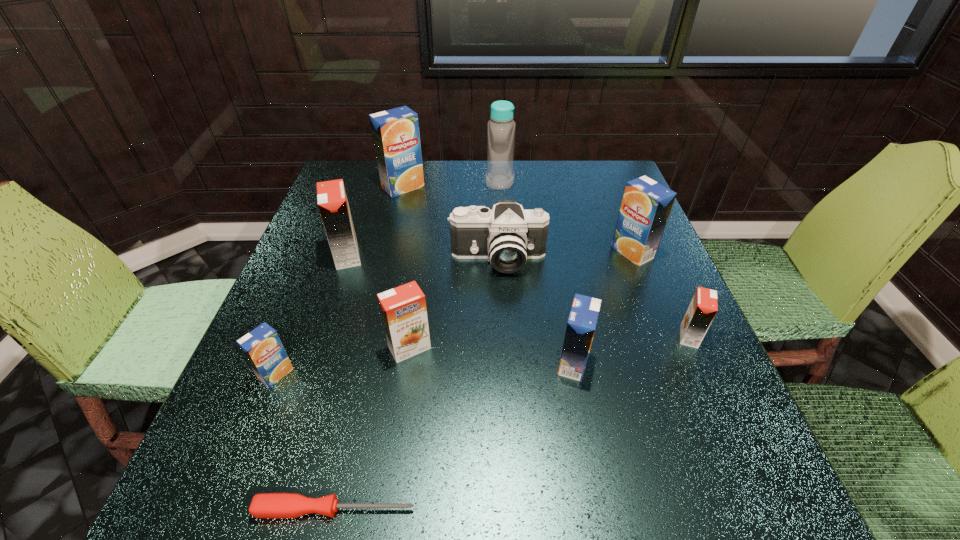
I want to click on object situated at the near left corner, so click(264, 505).

This screenshot has height=540, width=960. I want to click on free location at the far edge, so [x=445, y=164].

This screenshot has width=960, height=540. I want to click on vacant space at the near edge of the desktop, so click(x=570, y=468).

In the image, there is a desktop. What are the coordinates of `vacant space at the left edge` in the screenshot? It's located at (309, 246).

Where is `free space at the right edge`? The width and height of the screenshot is (960, 540). free space at the right edge is located at coordinates (651, 360).

I want to click on vacant area at the far left corner, so click(x=361, y=165).

Identify the location of vacant space at the near right corner of the desktop. (766, 468).

Where is `vacant region between the rightmost orange orange juice and the biggest orange orange juice`? Image resolution: width=960 pixels, height=540 pixels. vacant region between the rightmost orange orange juice and the biggest orange orange juice is located at coordinates (518, 296).

Find the location of `free space between the screwdriver and the second smallest blue orange_juice`. free space between the screwdriver and the second smallest blue orange_juice is located at coordinates (454, 436).

At what (x,y) coordinates should I click in order to perform the action: click on free spot between the second smallest blue orange_juice and the biggest blue orange_juice. Please return your answer as a coordinate pair (x, y). The width and height of the screenshot is (960, 540). Looking at the image, I should click on (488, 275).